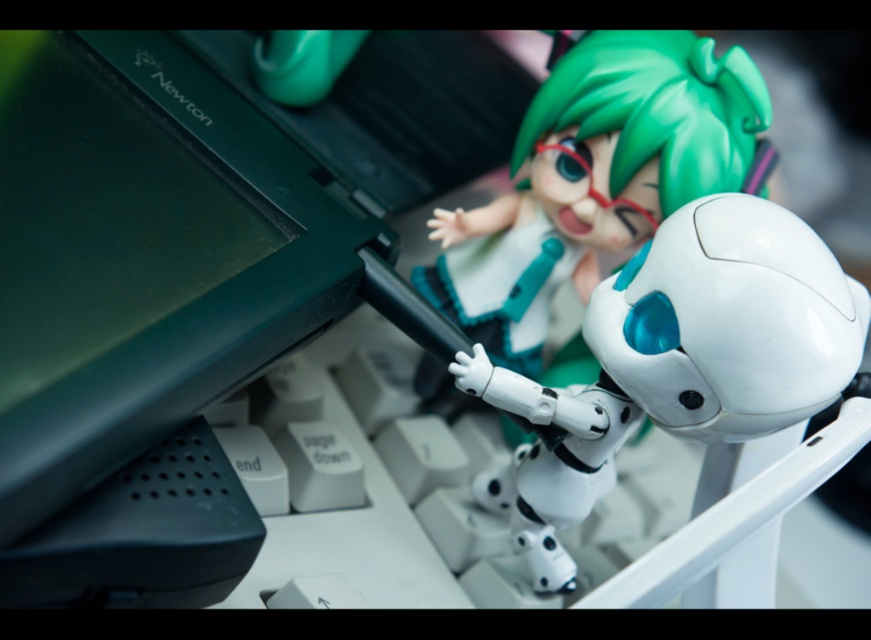
Which is more to the right, white matte robot at center or matte white robot at center?

Positioned to the right is white matte robot at center.

Does white matte robot at center come behind matte white robot at center?

No, it is in front of matte white robot at center.

Between point (643, 259) and point (498, 252), which one is positioned behind?

The point (498, 252) is behind.

At what (x,y) coordinates should I click in order to perform the action: click on white matte robot at center. Please return your answer as a coordinate pair (x, y). The width and height of the screenshot is (871, 640). Looking at the image, I should click on (706, 332).

Is black plastic computer at center positioned in front of white matte robot at center?

That is True.

In the scene shown: Does black plastic computer at center appear under white matte robot at center?

Actually, black plastic computer at center is above white matte robot at center.

The image size is (871, 640). What are the coordinates of `black plastic computer at center` in the screenshot? It's located at (184, 278).

In order to click on black plastic computer at center in this screenshot , I will do `click(184, 278)`.

Is black plastic computer at center below matte white robot at center?

Answer: No.

The height and width of the screenshot is (640, 871). What are the coordinates of `black plastic computer at center` in the screenshot? It's located at (184, 278).